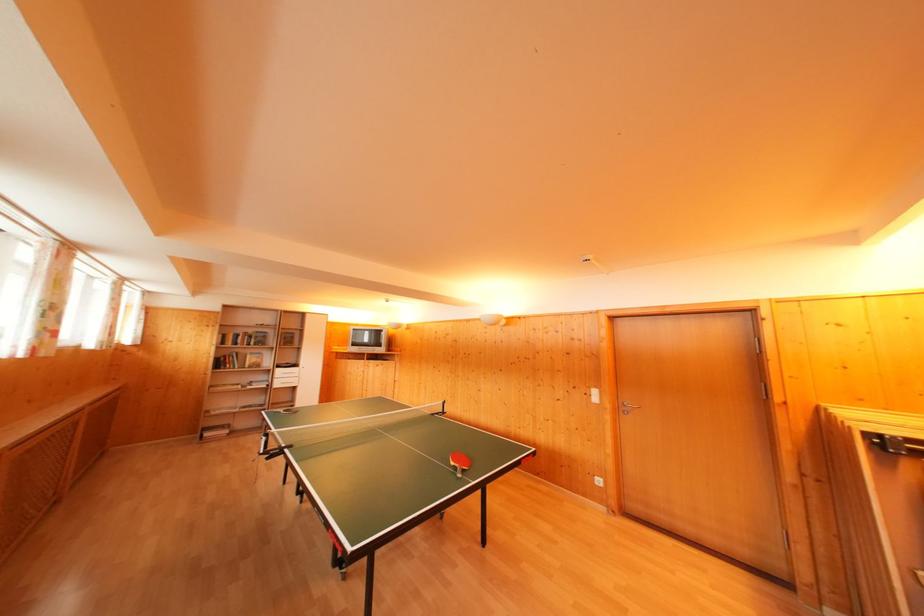
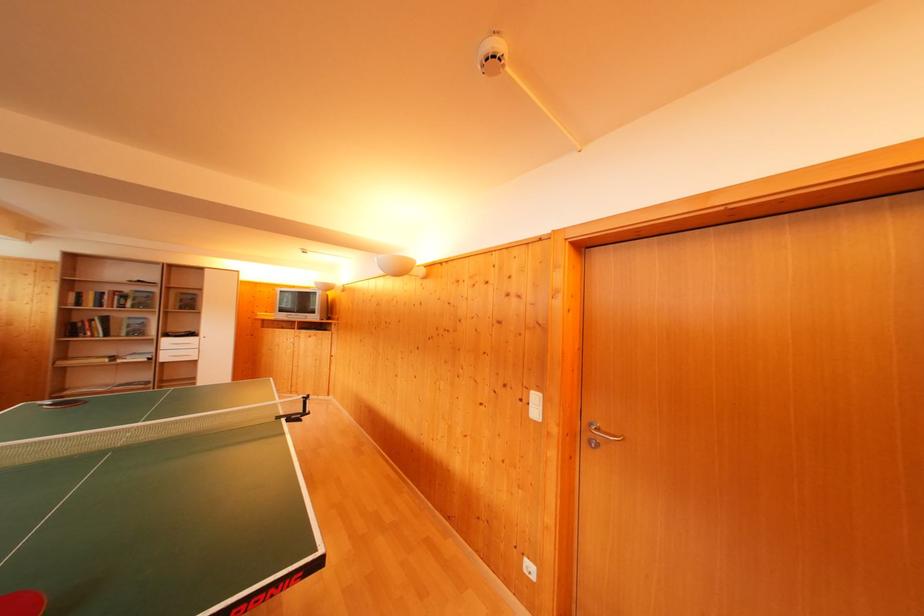
The point at (x=225, y=368) is marked in the first image. Where is the corresponding point in the second image?

(76, 334)